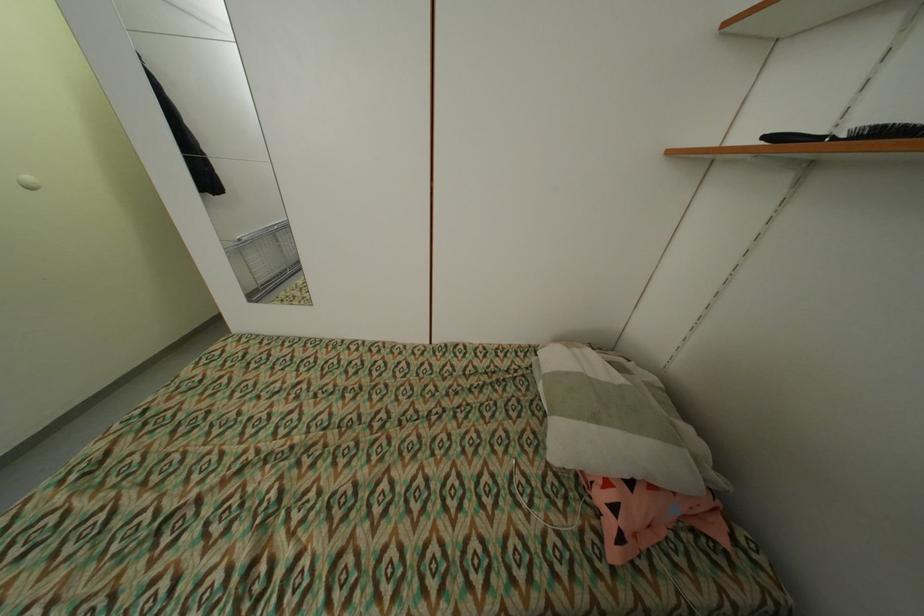
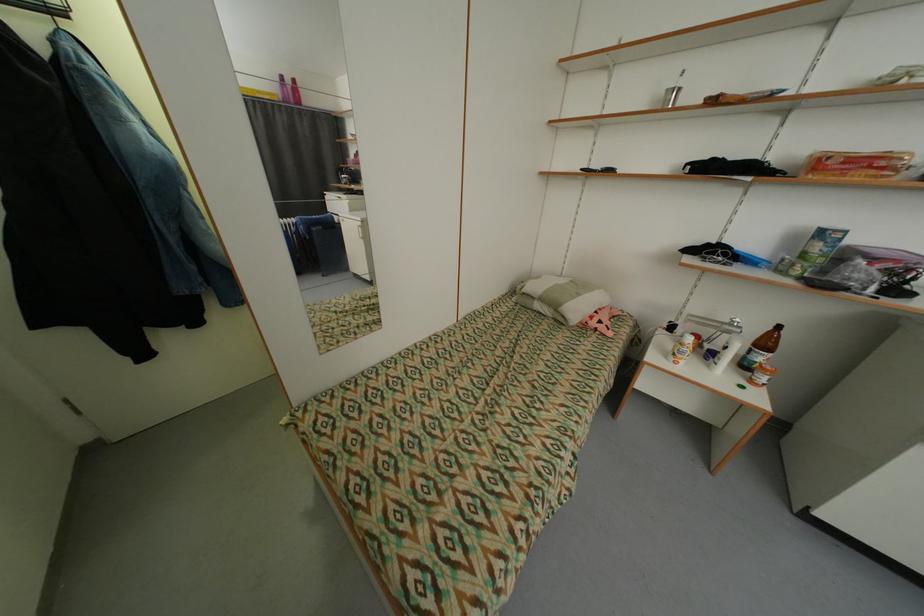
Find the pixel in the second image that matches point 606,498 in the first image.

(600, 323)